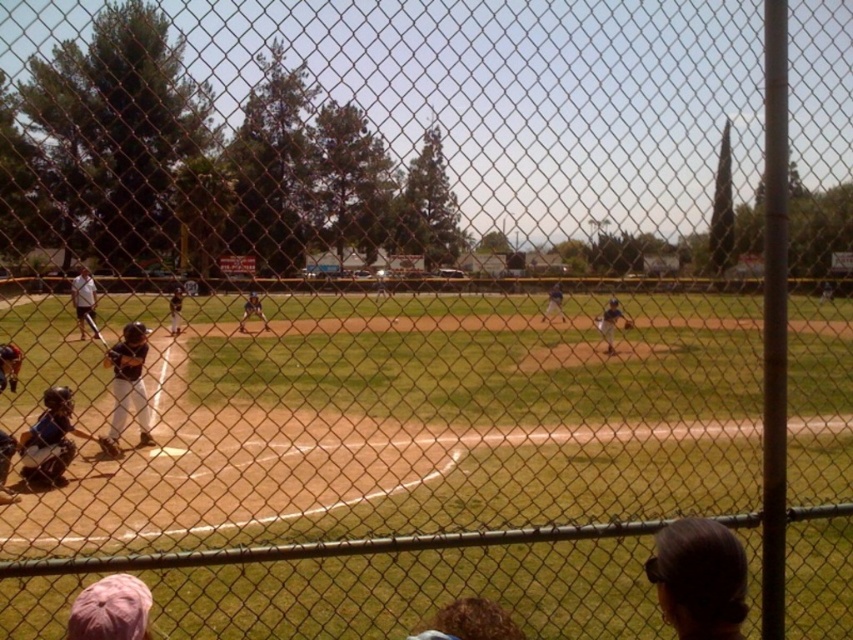
Is dark brown hair at lower right wider than matte black baseball bat at left?

No, dark brown hair at lower right is not wider than matte black baseball bat at left.

In the scene shown: Is dark brown hair at lower right shorter than matte black baseball bat at left?

Correct, dark brown hair at lower right is not as tall as matte black baseball bat at left.

Between point (668, 554) and point (80, 298), which one is positioned in front?

Positioned in front is point (668, 554).

At what (x,y) coordinates should I click in order to perform the action: click on dark brown hair at lower right. Please return your answer as a coordinate pair (x, y). Looking at the image, I should click on (699, 579).

In the scene shown: Which of these two, blue uniform at center or matte blue baseball glove at center, stands taller?

matte blue baseball glove at center is taller.

Does point (605, 337) lie in front of point (554, 284)?

Yes.

What are the coordinates of `blue uniform at center` in the screenshot? It's located at (610, 323).

Where is `blue uniform at center`? blue uniform at center is located at coordinates (610, 323).

Can you confirm if matte black baseball glove at center is shorter than brown leather glove at center?

Incorrect, matte black baseball glove at center's height does not fall short of brown leather glove at center's.

Who is shorter, matte black baseball glove at center or brown leather glove at center?

brown leather glove at center is shorter.

Where is `matte black baseball glove at center`? matte black baseball glove at center is located at coordinates (252, 310).